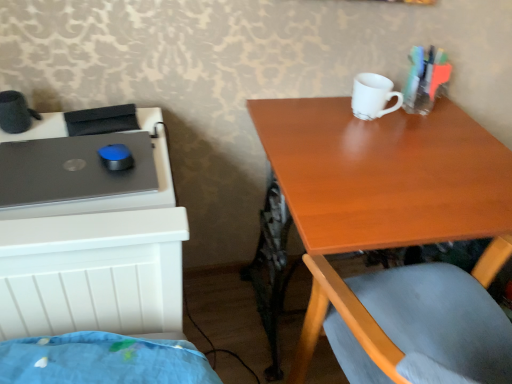
You are a GUI agent. You are given a task and a screenshot of the screen. Output one action in this format:
    pyautogui.click(x=<x>, y=<y>)
    Task: Click on the empty space that is to the right of white matte mug at upper center
    The height and width of the screenshot is (384, 512).
    Given the screenshot: What is the action you would take?
    coord(435,130)